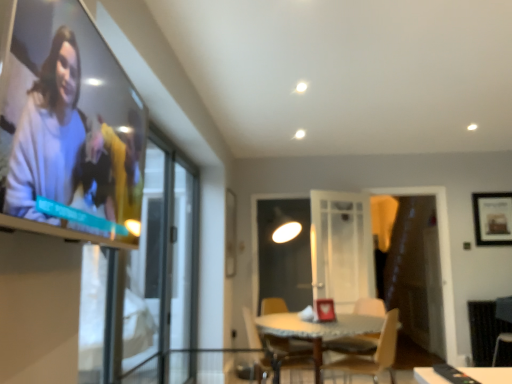
Question: Can you confirm if transparent glass screen door at left, acting as the 1th screen door starting from the front, is thinner than matte white sweater at upper left?

Choices:
 (A) yes
 (B) no

Answer: (A)

Question: Can you confirm if transparent glass screen door at left, acting as the 1th screen door starting from the front, is wider than matte white sweater at upper left?

Choices:
 (A) yes
 (B) no

Answer: (B)

Question: From a real-world perspective, is transparent glass screen door at left, acting as the 1th screen door starting from the front, over matte white sweater at upper left?

Choices:
 (A) yes
 (B) no

Answer: (B)

Question: Is transparent glass screen door at left, acting as the 1th screen door starting from the front, not inside matte white sweater at upper left?

Choices:
 (A) no
 (B) yes

Answer: (B)

Question: Does transparent glass screen door at left, which is the second screen door from back to front, have a smaller size compared to matte white sweater at upper left?

Choices:
 (A) yes
 (B) no

Answer: (B)

Question: Choose the correct answer: Is transparent glass screen door at left, acting as the 1th screen door starting from the front, inside wooden chair at lower center, the first chair when ordered from left to right, or outside it?

Choices:
 (A) outside
 (B) inside

Answer: (A)

Question: From a real-world perspective, relative to wooden chair at lower center, the first chair when ordered from left to right, is transparent glass screen door at left, acting as the 1th screen door starting from the front, vertically above or below?

Choices:
 (A) above
 (B) below

Answer: (A)

Question: Visually, is transparent glass screen door at left, which is the second screen door from back to front, positioned to the left or to the right of wooden chair at lower center, the second chair from the right?

Choices:
 (A) right
 (B) left

Answer: (B)

Question: Considering the positions of point (151, 226) and point (257, 324), is point (151, 226) closer or farther from the camera than point (257, 324)?

Choices:
 (A) closer
 (B) farther

Answer: (A)

Question: Considering the positions of point (504, 312) and point (393, 332), is point (504, 312) closer or farther from the camera than point (393, 332)?

Choices:
 (A) farther
 (B) closer

Answer: (A)

Question: Is dark brown leather armchair at lower right situated inside wooden chair at center, the 1th chair positioned from the right, or outside?

Choices:
 (A) inside
 (B) outside

Answer: (B)

Question: In the image, is dark brown leather armchair at lower right positioned in front of or behind wooden chair at center, the second chair positioned from the left?

Choices:
 (A) behind
 (B) front

Answer: (A)

Question: Visually, is dark brown leather armchair at lower right positioned to the left or to the right of wooden chair at center, the 1th chair positioned from the right?

Choices:
 (A) right
 (B) left

Answer: (A)

Question: Does point (474, 377) appear closer or farther from the camera than point (271, 331)?

Choices:
 (A) farther
 (B) closer

Answer: (B)

Question: Choose the correct answer: Is white glossy table at center inside wooden chair at lower center, the second chair from the right, or outside it?

Choices:
 (A) inside
 (B) outside

Answer: (B)